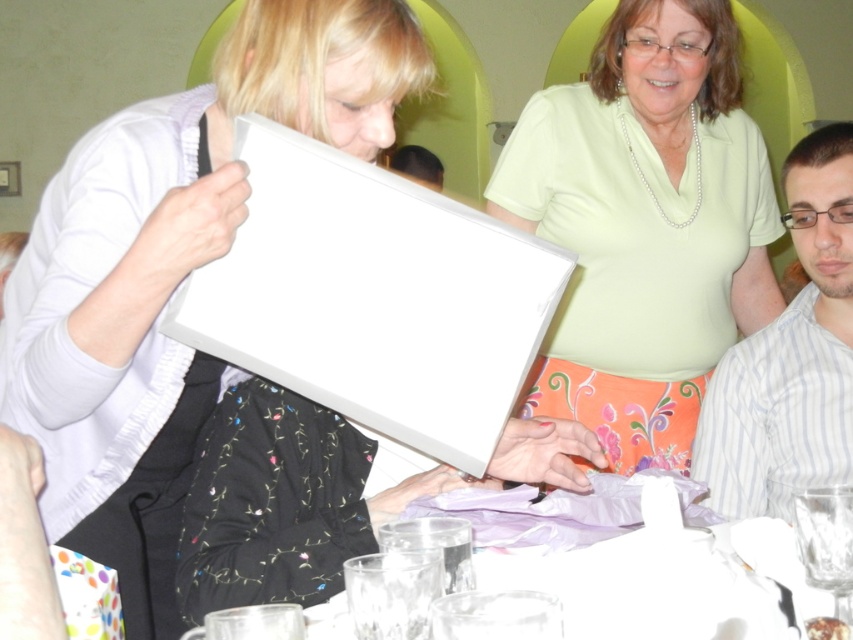
You are standing in the dining area and want to place a new decorative item exactly where the matte white frame at center is currently located. According to the coordinates provided, what are the coordinates of the spot where you should place the new item?

The coordinates for the spot where the matte white frame at center is located are at point (645, 225).

You are planning to place a new decorative item on the table. Given the current arrangement, which object at the center has a greater width, the matte white frame at center or the translucent glass table at center?

The matte white frame at center has a greater width than the translucent glass table at center according to the description.